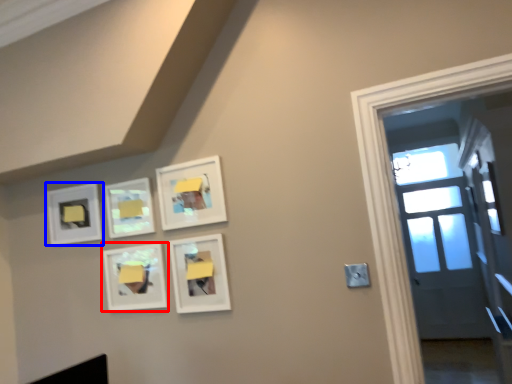
Question: Which object is closer to the camera taking this photo, picture frame (highlighted by a red box) or picture frame (highlighted by a blue box)?

Choices:
 (A) picture frame
 (B) picture frame

Answer: (A)